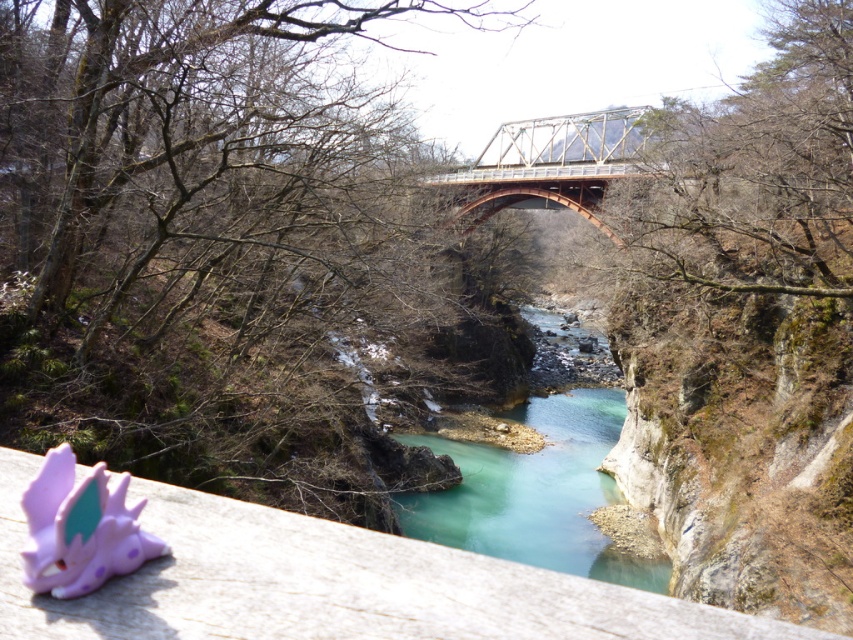
You are standing on a wooden ledge overlooking a river. You want to throw a pebble into the turquoise smooth water at center. Considering the distance between you and the water, will the pebble reach the water if you throw it with a typical arm strength?

The distance between you and the turquoise smooth water at center is 80.46 feet. With typical arm strength, a pebble can be thrown about 30 to 50 feet. Therefore, the pebble will not reach the water.

You are standing on the wooden surface in the scene and want to look at the turquoise smooth water at center and the metallic orange bridge at center. Which object is positioned to the right side from your viewpoint?

The turquoise smooth water at center is positioned to the right of the metallic orange bridge at center from your viewpoint.

From the picture: You are standing on the wooden surface in the scene and want to pick up the purple plastic toy at lower left. Which direction should you move relative to the turquoise smooth water at center?

The purple plastic toy at lower left is to the left of the turquoise smooth water at center, so you should move to the left side of the turquoise smooth water at center to pick it up.